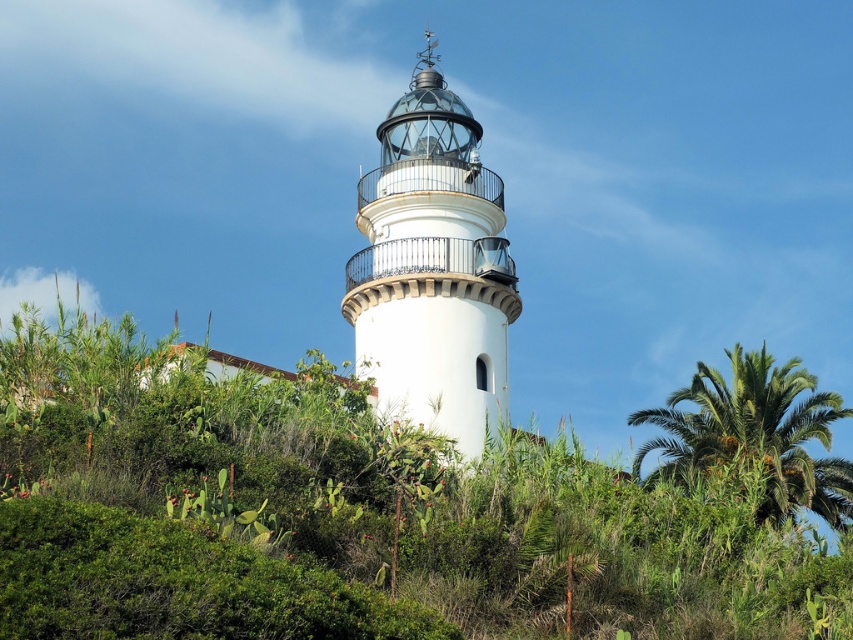
Who is taller, white matte/light tower at center or green leafy palm tree at right?

Standing taller between the two is white matte/light tower at center.

Based on the photo, is white matte/light tower at center to the right of green leafy palm tree at right from the viewer's perspective?

Incorrect, white matte/light tower at center is not on the right side of green leafy palm tree at right.

Locate an element on the screen. This screenshot has height=640, width=853. white matte/light tower at center is located at coordinates (433, 268).

I want to click on white matte/light tower at center, so click(x=433, y=268).